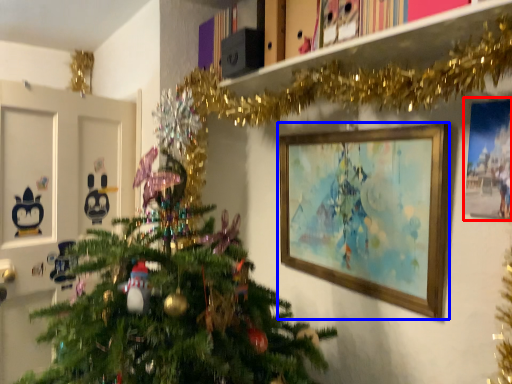
Question: Which object appears farthest to the camera in this image, picture frame (highlighted by a red box) or picture frame (highlighted by a blue box)?

Choices:
 (A) picture frame
 (B) picture frame

Answer: (B)